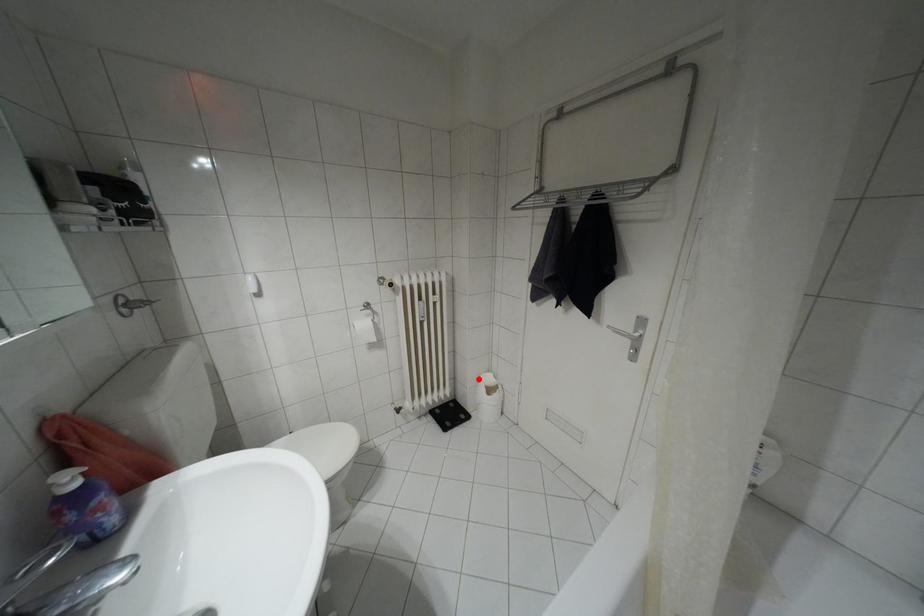
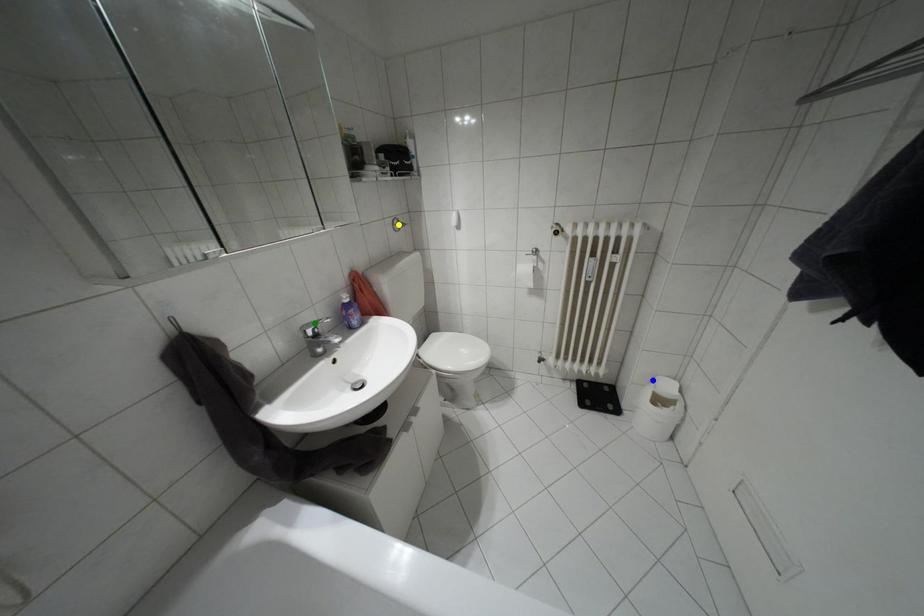
Question: I am providing you with two images of the same scene from different viewpoints. A red point is marked on the first image. You are given multiple points on the second image. Which spot in image 2 lines up with the point in image 1?

Choices:
 (A) blue point
 (B) green point
 (C) yellow point

Answer: (A)